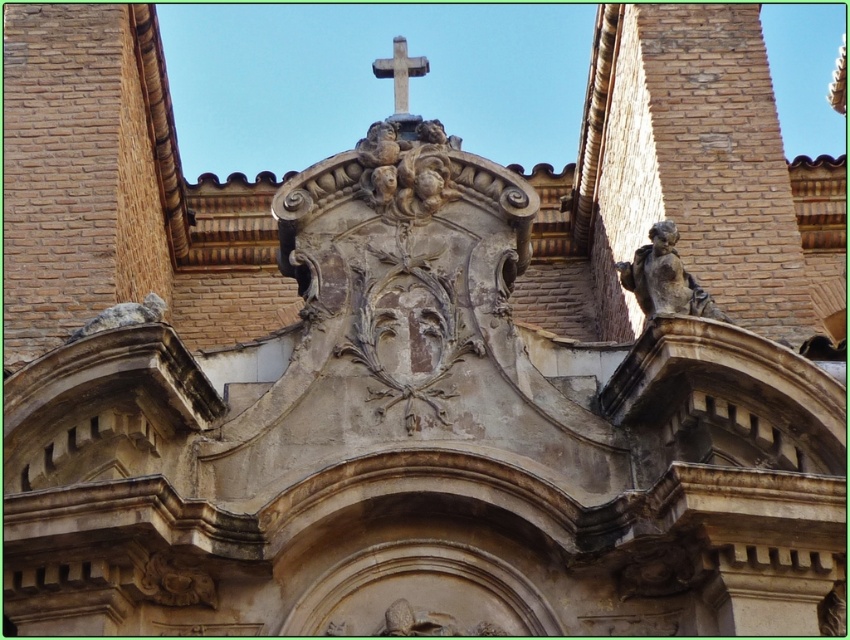
Which is more to the left, stone statue at right or white stone cross at upper center?

white stone cross at upper center is more to the left.

Based on the photo, does stone statue at right have a greater height compared to white stone cross at upper center?

Incorrect, stone statue at right's height is not larger of white stone cross at upper center's.

Find the location of a particular element. The width and height of the screenshot is (850, 640). stone statue at right is located at coordinates (664, 278).